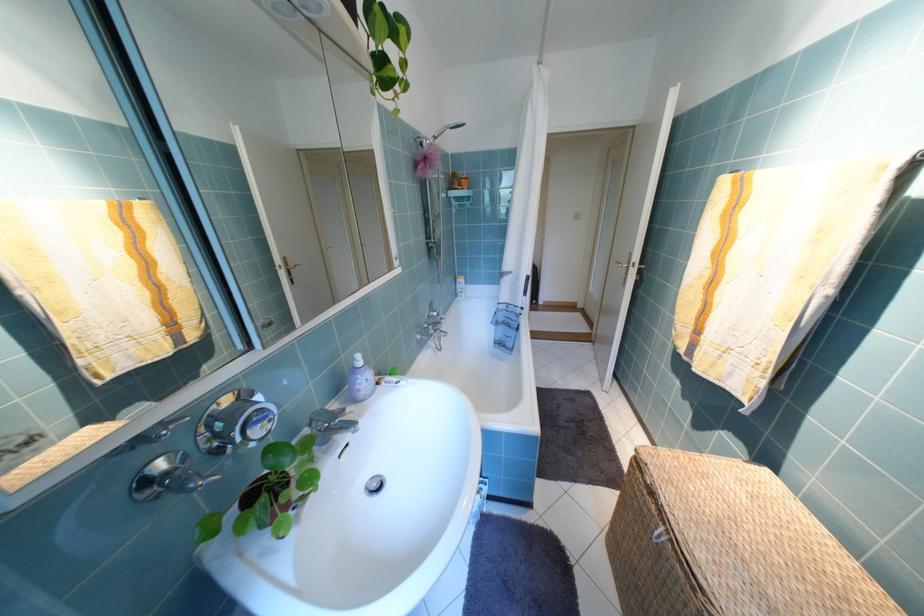
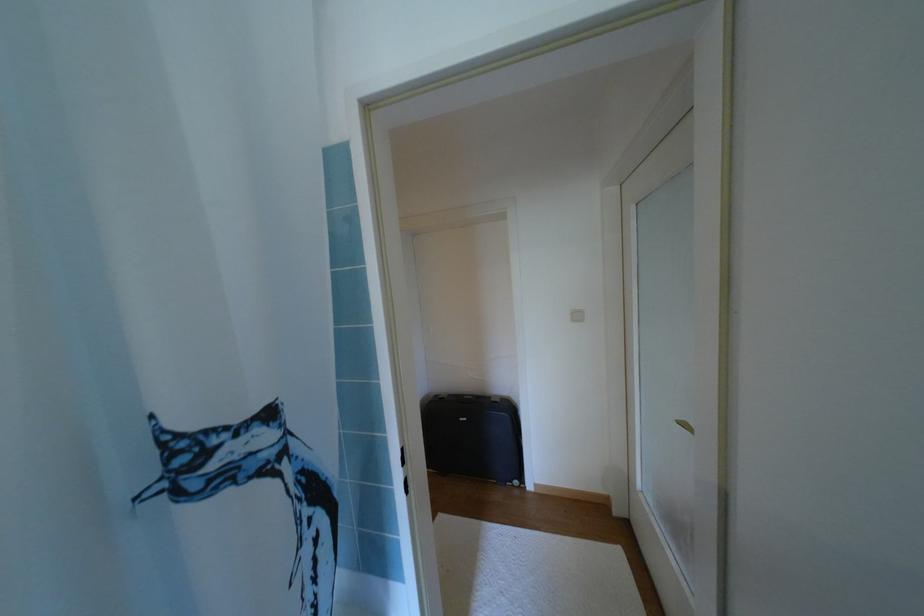
Which direction would the cameraman need to move to produce the second image?

The cameraman moved toward right, forward.